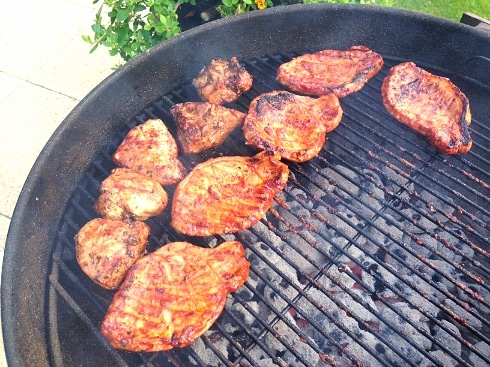
At what (x,y) coordinates should I click in order to perform the action: click on handle. Please return your answer as a coordinate pair (x, y). Image resolution: width=490 pixels, height=367 pixels. Looking at the image, I should click on (191, 6).